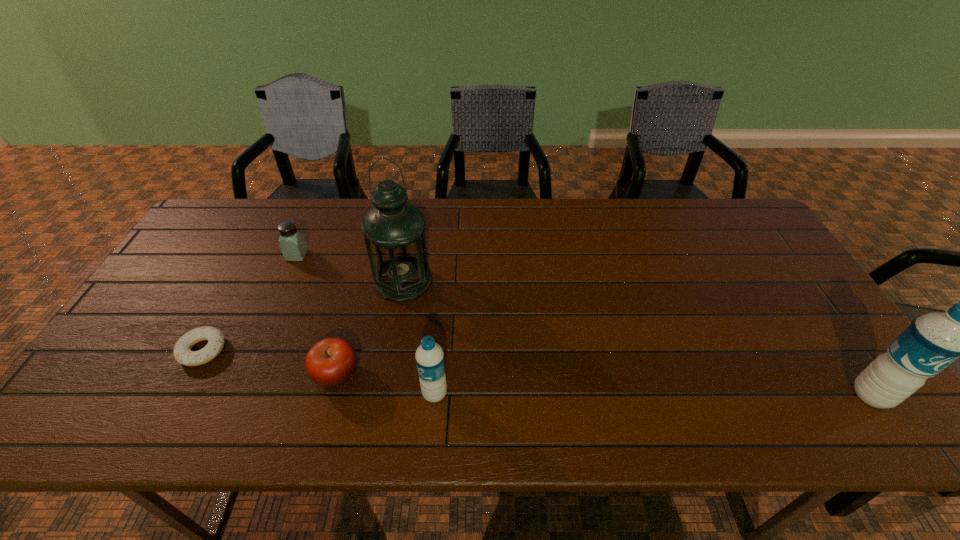
Locate an element on the screen. The width and height of the screenshot is (960, 540). object that is at the near left corner is located at coordinates (182, 352).

This screenshot has width=960, height=540. Identify the location of object present at the near right corner. (932, 342).

Locate an element on the screen. This screenshot has width=960, height=540. vacant space at the far edge is located at coordinates click(494, 219).

At what (x,y) coordinates should I click in order to perform the action: click on vacant space at the near edge of the desktop. Please return your answer as a coordinate pair (x, y). Image resolution: width=960 pixels, height=540 pixels. Looking at the image, I should click on pyautogui.click(x=175, y=380).

The width and height of the screenshot is (960, 540). I want to click on vacant space at the right edge of the desktop, so click(x=763, y=321).

This screenshot has width=960, height=540. Find the location of `vacant area at the far left corner`. vacant area at the far left corner is located at coordinates (256, 212).

In the image, there is a desktop. Where is `free space at the far right corner`? free space at the far right corner is located at coordinates (753, 222).

The width and height of the screenshot is (960, 540). I want to click on vacant space in between the apple and the taller water bottle, so click(x=604, y=384).

Locate an element on the screen. The width and height of the screenshot is (960, 540). empty space between the shorter water bottle and the saltshaker is located at coordinates (366, 325).

What are the coordinates of `unoccupied area between the fifth object from right to left and the taller water bottle` in the screenshot? It's located at (585, 325).